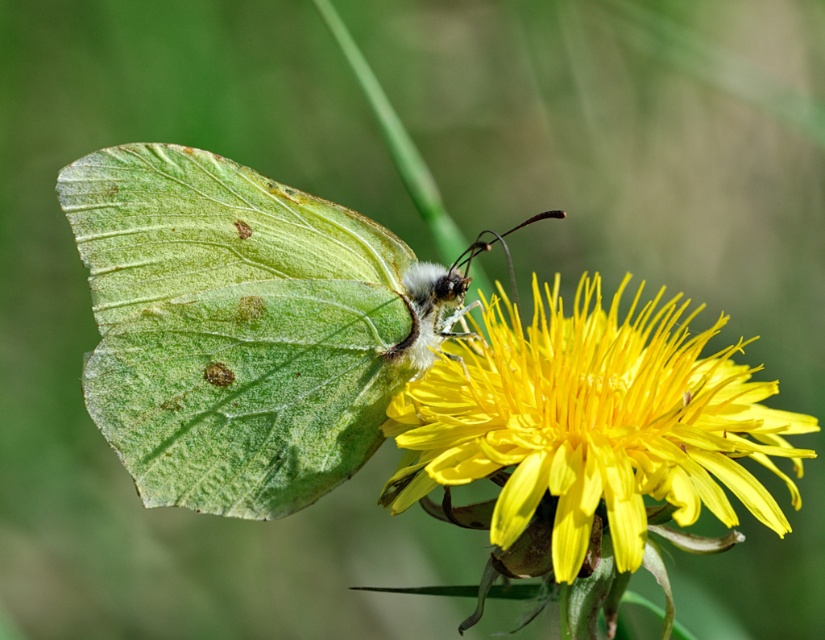
Question: In this image, where is green matte butterfly at center located relative to yellow matte flower at center?

Choices:
 (A) left
 (B) right

Answer: (A)

Question: Which point is farther from the camera taking this photo?

Choices:
 (A) pyautogui.click(x=540, y=401)
 (B) pyautogui.click(x=293, y=248)

Answer: (B)

Question: Is green matte butterfly at center above yellow matte flower at center?

Choices:
 (A) no
 (B) yes

Answer: (B)

Question: Is green matte butterfly at center smaller than yellow matte flower at center?

Choices:
 (A) no
 (B) yes

Answer: (B)

Question: Which point is closer to the camera?

Choices:
 (A) green matte butterfly at center
 (B) yellow matte flower at center

Answer: (B)